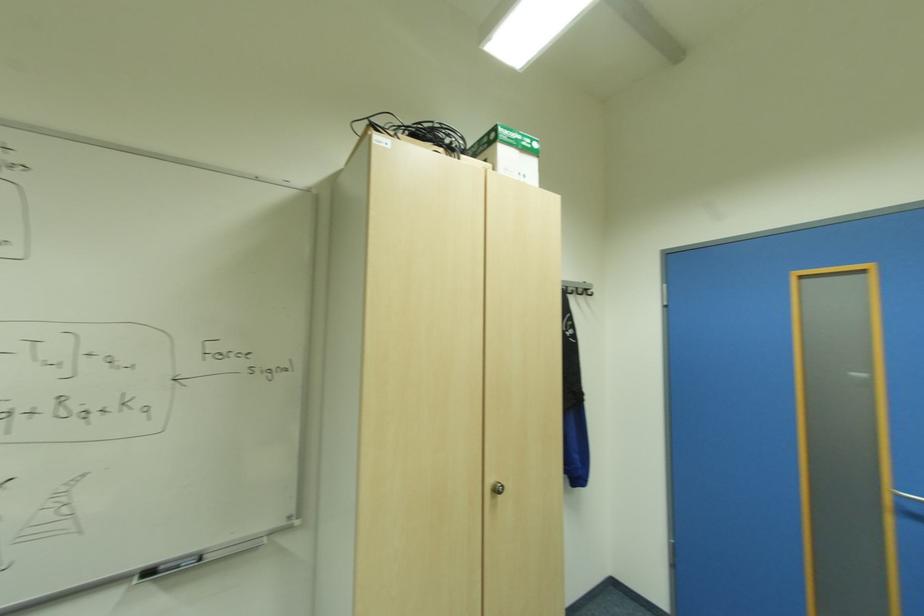
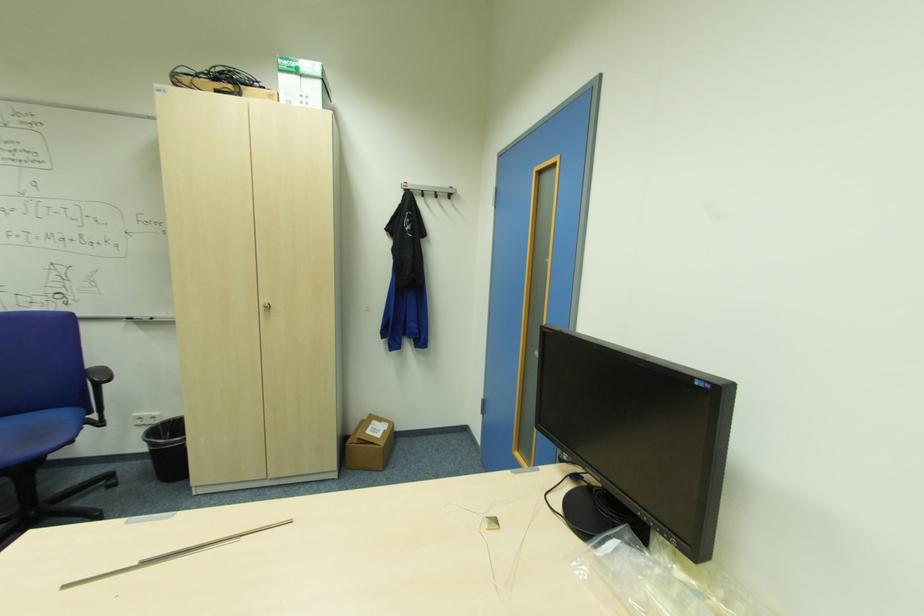
Locate, in the second image, the point that corresponds to pixel 506 139 in the first image.

(287, 69)